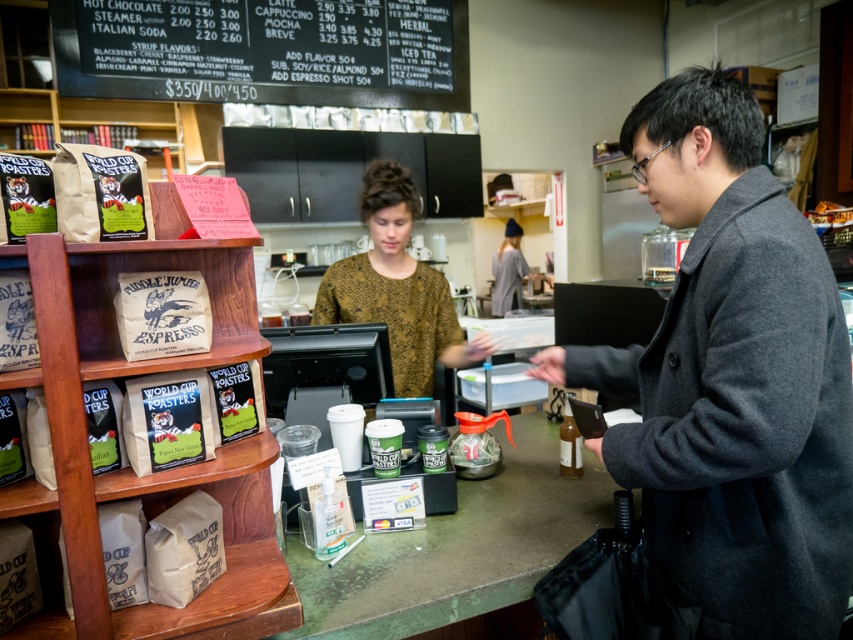
You are a customer in the coffee shop and want to place your dark gray wool coat at center right on the counter. Is there enough space on the green matte counter at center to place it?

The dark gray wool coat at center right is to the right of the green matte counter at center, so placing it on the counter may be possible. However, the counter is cluttered with items like cups, a sanitizer dispenser, credit card reader, and paper bags, so you need to check if there is enough space after moving some items aside.

You are a customer in the coffee shop and want to check your phone while waiting in line. You notice the dark gray wool coat at center right and the brown textured blouse at center. Which item is closer to your right side?

The dark gray wool coat at center right is to the right of brown textured blouse at center, so it is closer to your right side.